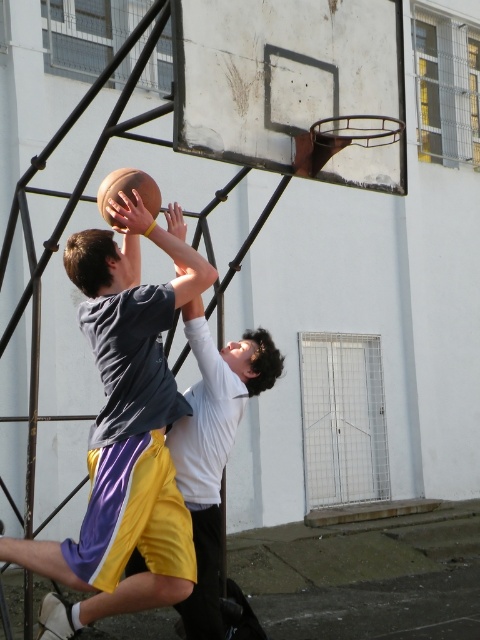
Based on the coordinates provided, where is the matte gray shirt at center located in the image?

The matte gray shirt at center is located at the coordinates point (127,426).

You are a photographer trying to capture a clear shot of both the matte gray shirt at center and the rubber textured basketball at center. Since you want both subjects to appear equally prominent in the photo, which object should you zoom in on more?

The matte gray shirt at center is larger in size than the rubber textured basketball at center, so you should zoom in more on the rubber textured basketball at center to balance their prominence in the photo.

You are a basketball player trying to block the shot. The matte gray shirt at center is attempting to shoot the rubber textured basketball at center. If your reach is 32 inches, can you reach the basketball before it goes into the hoop?

The distance between the matte gray shirt at center and the rubber textured basketball at center is 33.14 inches. Since your reach is 32 inches, you cannot reach the basketball before it goes into the hoop.